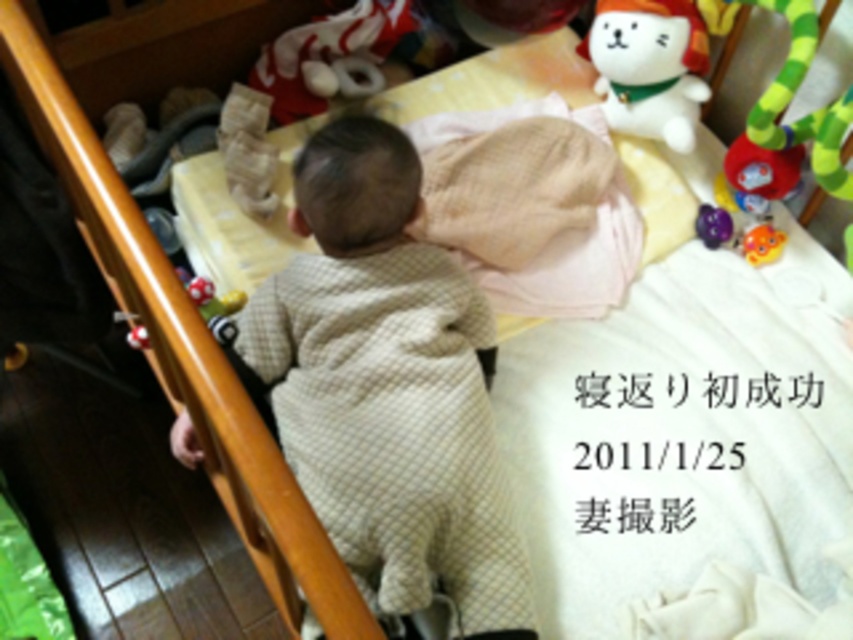
Question: Does white plush cat at upper right have a larger size compared to yellow rubber duck at upper right?

Choices:
 (A) no
 (B) yes

Answer: (B)

Question: Which object appears closest to the camera in this image?

Choices:
 (A) yellow rubber duck at upper right
 (B) light beige fabric baby at center
 (C) white plush cat at upper right

Answer: (B)

Question: Which object is farther from the camera taking this photo?

Choices:
 (A) white plush cat at upper right
 (B) light beige fabric baby at center
 (C) yellow rubber duck at upper right

Answer: (C)

Question: In this image, where is white plush cat at upper right located relative to yellow rubber duck at upper right?

Choices:
 (A) above
 (B) below

Answer: (A)

Question: Among these objects, which one is farthest from the camera?

Choices:
 (A) light beige fabric baby at center
 (B) white plush cat at upper right

Answer: (B)

Question: Does white plush cat at upper right have a larger size compared to yellow rubber duck at upper right?

Choices:
 (A) no
 (B) yes

Answer: (B)